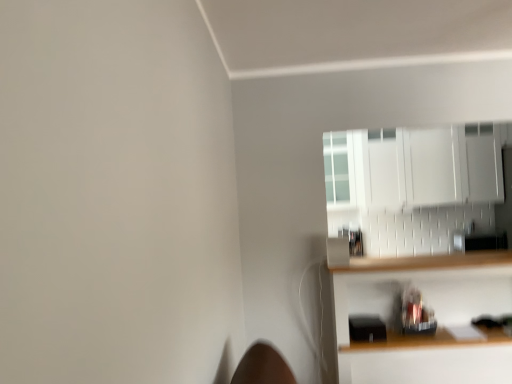
The width and height of the screenshot is (512, 384). Describe the element at coordinates (412, 184) in the screenshot. I see `white glossy cabinet at upper right` at that location.

Image resolution: width=512 pixels, height=384 pixels. In order to click on white glossy cabinet at upper right in this screenshot , I will do `click(412, 184)`.

This screenshot has width=512, height=384. Find the location of `wooden shelf at lower right`. wooden shelf at lower right is located at coordinates tap(436, 317).

What do you see at coordinates (436, 317) in the screenshot?
I see `wooden shelf at lower right` at bounding box center [436, 317].

Where is `white glossy cabinet at upper right`? The height and width of the screenshot is (384, 512). white glossy cabinet at upper right is located at coordinates (412, 184).

Which object is positioned more to the right, white glossy cabinet at upper right or wooden shelf at lower right?

white glossy cabinet at upper right is more to the right.

Relative to wooden shelf at lower right, is white glossy cabinet at upper right in front or behind?

Clearly, white glossy cabinet at upper right is behind wooden shelf at lower right.

Between point (489, 158) and point (462, 372), which one is positioned behind?

The point (489, 158) is more distant.

From the image's perspective, is white glossy cabinet at upper right on wooden shelf at lower right?

Correct, white glossy cabinet at upper right appears higher than wooden shelf at lower right in the image.

From a real-world perspective, is white glossy cabinet at upper right positioned under wooden shelf at lower right based on gravity?

Actually, white glossy cabinet at upper right is physically above wooden shelf at lower right in the real world.

Is white glossy cabinet at upper right wider than wooden shelf at lower right?

No.

Considering the relative sizes of white glossy cabinet at upper right and wooden shelf at lower right in the image provided, is white glossy cabinet at upper right taller than wooden shelf at lower right?

Incorrect, the height of white glossy cabinet at upper right is not larger of that of wooden shelf at lower right.

Considering the sizes of objects white glossy cabinet at upper right and wooden shelf at lower right in the image provided, who is smaller, white glossy cabinet at upper right or wooden shelf at lower right?

With smaller size is white glossy cabinet at upper right.

Do you think white glossy cabinet at upper right is within wooden shelf at lower right, or outside of it?

white glossy cabinet at upper right is spatially situated outside wooden shelf at lower right.

Would you consider white glossy cabinet at upper right to be distant from wooden shelf at lower right?

Yes, white glossy cabinet at upper right and wooden shelf at lower right are located far from each other.

From the picture: Does white glossy cabinet at upper right turn towards wooden shelf at lower right?

No, white glossy cabinet at upper right is not facing towards wooden shelf at lower right.

This screenshot has height=384, width=512. In order to click on cabinetry behind the wooden shelf at lower right in this screenshot , I will do `click(412, 184)`.

Based on the photo, considering the positions of objects wooden shelf at lower right and white glossy cabinet at upper right in the image provided, who is more to the right, wooden shelf at lower right or white glossy cabinet at upper right?

From the viewer's perspective, white glossy cabinet at upper right appears more on the right side.

Relative to white glossy cabinet at upper right, is wooden shelf at lower right in front or behind?

wooden shelf at lower right is in front of white glossy cabinet at upper right.

Which is in front, point (356, 307) or point (373, 252)?

Point (356, 307)

From the image's perspective, is wooden shelf at lower right located beneath white glossy cabinet at upper right?

Yes, from the image's perspective, wooden shelf at lower right is beneath white glossy cabinet at upper right.

From a real-world perspective, does wooden shelf at lower right stand above white glossy cabinet at upper right?

No, from a real-world perspective, wooden shelf at lower right is not on top of white glossy cabinet at upper right.

Between wooden shelf at lower right and white glossy cabinet at upper right, which one has smaller width?

With smaller width is white glossy cabinet at upper right.

From their relative heights in the image, would you say wooden shelf at lower right is taller or shorter than white glossy cabinet at upper right?

In the image, wooden shelf at lower right appears to be taller than white glossy cabinet at upper right.

Can you confirm if wooden shelf at lower right is bigger than white glossy cabinet at upper right?

Yes, wooden shelf at lower right is bigger than white glossy cabinet at upper right.

Is wooden shelf at lower right positioned beyond the bounds of white glossy cabinet at upper right?

Yes, wooden shelf at lower right is located beyond the bounds of white glossy cabinet at upper right.

Does wooden shelf at lower right touch white glossy cabinet at upper right?

wooden shelf at lower right and white glossy cabinet at upper right are clearly separated.

Does wooden shelf at lower right turn towards white glossy cabinet at upper right?

No.

The height and width of the screenshot is (384, 512). I want to click on cabinetry on the right of wooden shelf at lower right, so click(412, 184).

Locate an element on the screen. This screenshot has width=512, height=384. cabinetry to the right of wooden shelf at lower right is located at coordinates (412, 184).

You are a GUI agent. You are given a task and a screenshot of the screen. Output one action in this format:
    pyautogui.click(x=<x>, y=<y>)
    Task: Click on the cabinetry above the wooden shelf at lower right (from a real-world perspective)
    This screenshot has width=512, height=384.
    Given the screenshot: What is the action you would take?
    pyautogui.click(x=412, y=184)